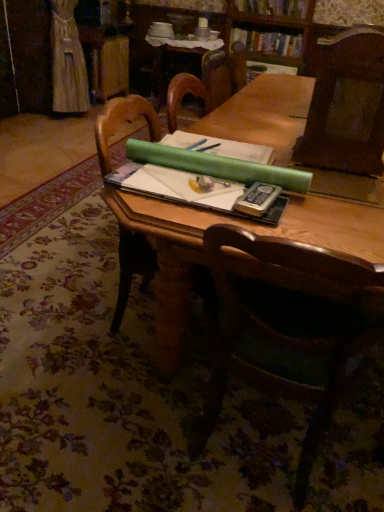
At what (x,y) coordinates should I click in order to perform the action: click on vacant space situated on the left part of hardcover book at center. Please return your answer as a coordinate pair (x, y). Looking at the image, I should click on (192, 205).